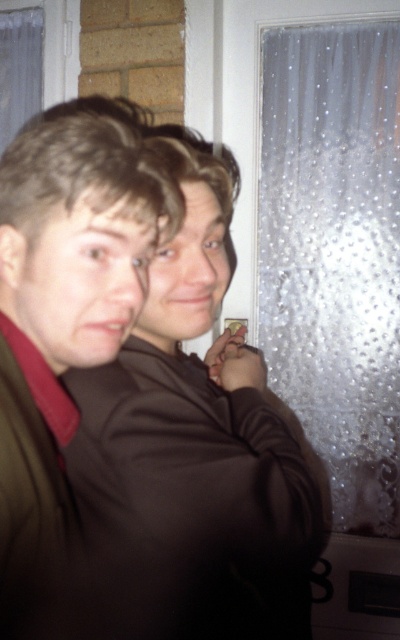
From the picture: Which of these two, brown matte jacket at center or frosted glass curtain at right, stands shorter?

With less height is brown matte jacket at center.

Measure the distance between brown matte jacket at center and frosted glass curtain at right.

brown matte jacket at center is 37.95 inches away from frosted glass curtain at right.

The height and width of the screenshot is (640, 400). Identify the location of brown matte jacket at center. (148, 396).